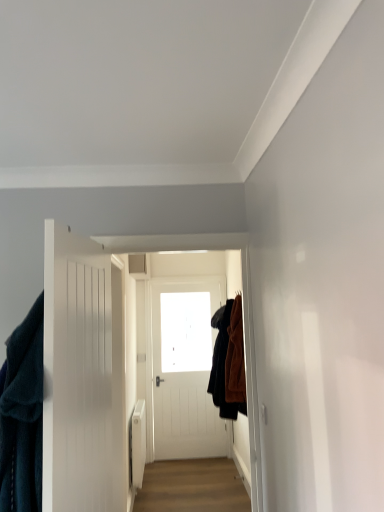
Question: From a real-world perspective, is white wooden door at left under velvety dark blue robe at left, the 2th clothing when ordered from back to front?

Choices:
 (A) yes
 (B) no

Answer: (B)

Question: Is white wooden door at left wider than velvety dark blue robe at left, the 2th clothing when ordered from back to front?

Choices:
 (A) yes
 (B) no

Answer: (B)

Question: Is white wooden door at left far away from velvety dark blue robe at left, placed as the 1th clothing when sorted from front to back?

Choices:
 (A) yes
 (B) no

Answer: (B)

Question: From a real-world perspective, is white wooden door at left located higher than velvety dark blue robe at left, placed as the 1th clothing when sorted from front to back?

Choices:
 (A) no
 (B) yes

Answer: (B)

Question: Is white wooden door at left thinner than velvety dark blue robe at left, placed as the 2th clothing when sorted from right to left?

Choices:
 (A) yes
 (B) no

Answer: (A)

Question: Is white wooden door at left bigger than velvety dark blue robe at left, placed as the 2th clothing when sorted from right to left?

Choices:
 (A) no
 (B) yes

Answer: (A)

Question: Does velvety dark blue robe at left, placed as the 2th clothing when sorted from right to left, have a greater width compared to white wooden door at left?

Choices:
 (A) yes
 (B) no

Answer: (A)

Question: Considering the relative sizes of velvety dark blue robe at left, the first clothing positioned from the left, and white wooden door at left in the image provided, is velvety dark blue robe at left, the first clothing positioned from the left, bigger than white wooden door at left?

Choices:
 (A) yes
 (B) no

Answer: (A)

Question: From the image's perspective, is velvety dark blue robe at left, placed as the 1th clothing when sorted from front to back, above white wooden door at left?

Choices:
 (A) yes
 (B) no

Answer: (B)

Question: Is velvety dark blue robe at left, the first clothing positioned from the left, closer to the viewer compared to white wooden door at left?

Choices:
 (A) yes
 (B) no

Answer: (B)

Question: Is white wooden door at left completely or partially inside velvety dark blue robe at left, the 2th clothing when ordered from back to front?

Choices:
 (A) yes
 (B) no

Answer: (B)

Question: Does velvety dark blue robe at left, placed as the 1th clothing when sorted from front to back, appear on the left side of transparent glass window at center?

Choices:
 (A) yes
 (B) no

Answer: (A)